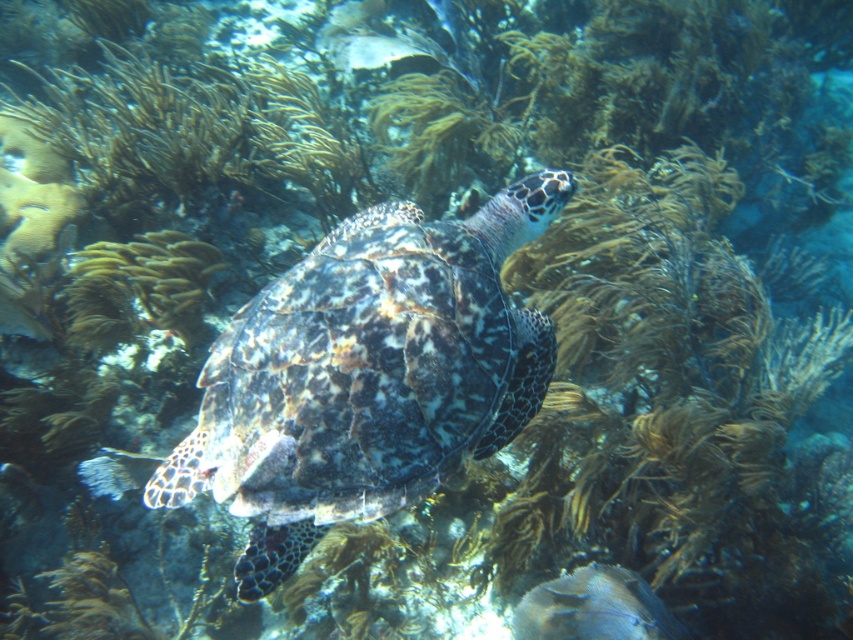
Where is the speckled shell turtle at center located in the image?

The speckled shell turtle at center is located at point (366, 376).

You are a marine biologist observing an underwater scene. You notice the speckled shell turtle at center and the brown textured coral at center. Which object is positioned lower in the water?

The speckled shell turtle at center is below brown textured coral at center, so the speckled shell turtle at center is positioned lower in the water.

You are a marine biologist observing an underwater scene. You need to collect a sample from a point located at coordinates point (360, 344). Your sampling tool has a maximum reach of 1.5 meters. Can you reach the point with your tool?

The distance of point (360, 344) from the camera is 1.48 meters, so yes, the sampling tool can reach the point since its maximum reach is 1.5 meters, which is longer than the distance required.